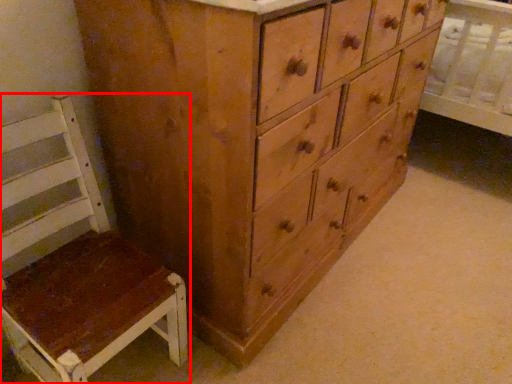
Question: From the image's perspective, what is the correct spatial relationship of furniture (annotated by the red box) in relation to chest of drawers?

Choices:
 (A) below
 (B) above

Answer: (A)